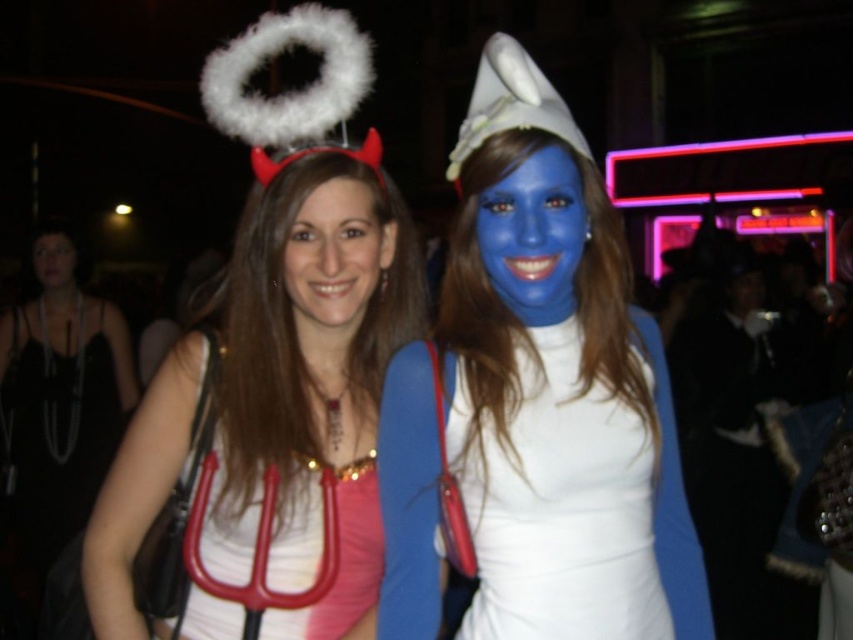
You are at a costume party and notice two objects in the scene. One is the white matte halo at upper center and the other is the matte white face at center. Which of these two objects is positioned to the left?

The white matte halo at upper center is positioned to the left of the matte white face at center.

You are at a costume party and see two people in front of you. The person on the left is dressed as a devil with red horns and a pitchfork, and the person on the right is dressed as a Smurf with blue face paint and a white hat. There is a point marked at coordinates [306,352]. Which object is located at that point?

The white matte halo at upper center is located at point [306,352].